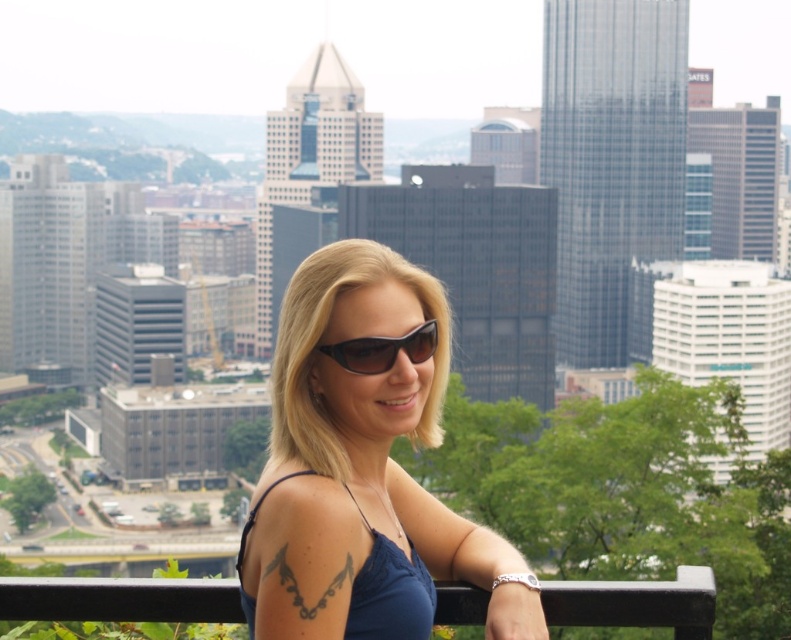
Question: Is blue fabric dress at center below black plastic sunglasses at center?

Choices:
 (A) no
 (B) yes

Answer: (B)

Question: Is black metal balustrade at lower center below blue fabric dress at center?

Choices:
 (A) no
 (B) yes

Answer: (B)

Question: Among these points, which one is nearest to the camera?

Choices:
 (A) (428, 616)
 (B) (479, 620)

Answer: (A)

Question: Among these objects, which one is nearest to the camera?

Choices:
 (A) blue fabric dress at center
 (B) black metal balustrade at lower center
 (C) matte blue tank top at center
 (D) black plastic sunglasses at center

Answer: (C)

Question: Estimate the real-world distances between objects in this image. Which object is closer to the blue fabric dress at center?

Choices:
 (A) black metal balustrade at lower center
 (B) black plastic sunglasses at center

Answer: (A)

Question: Where is matte blue tank top at center located in relation to blue fabric dress at center in the image?

Choices:
 (A) right
 (B) left

Answer: (A)